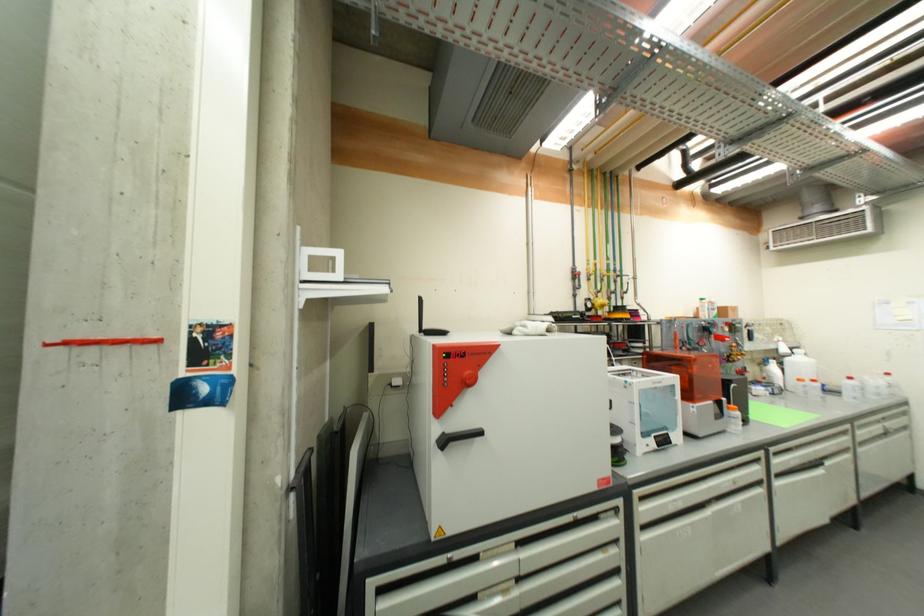
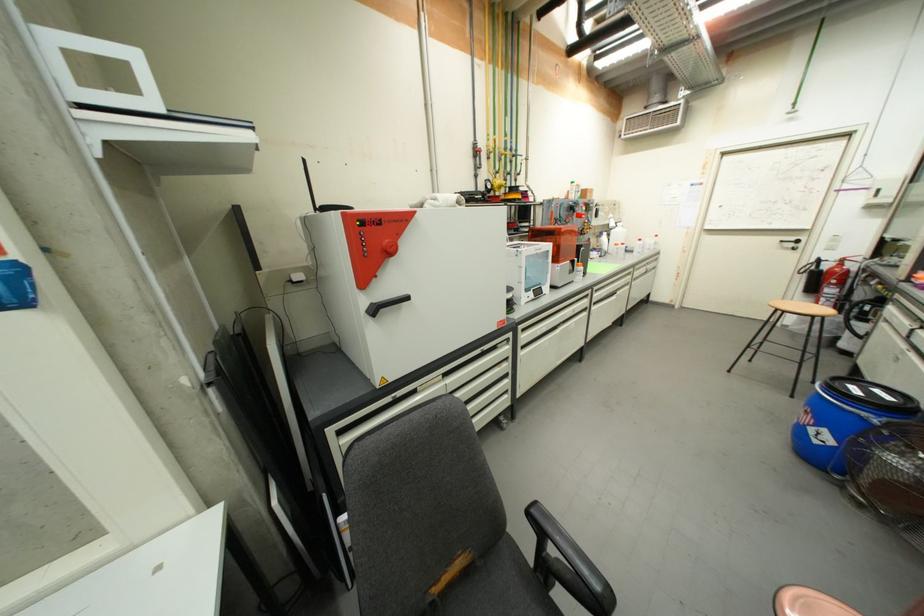
How did the camera likely rotate?

The rotation direction of the camera is right-down.